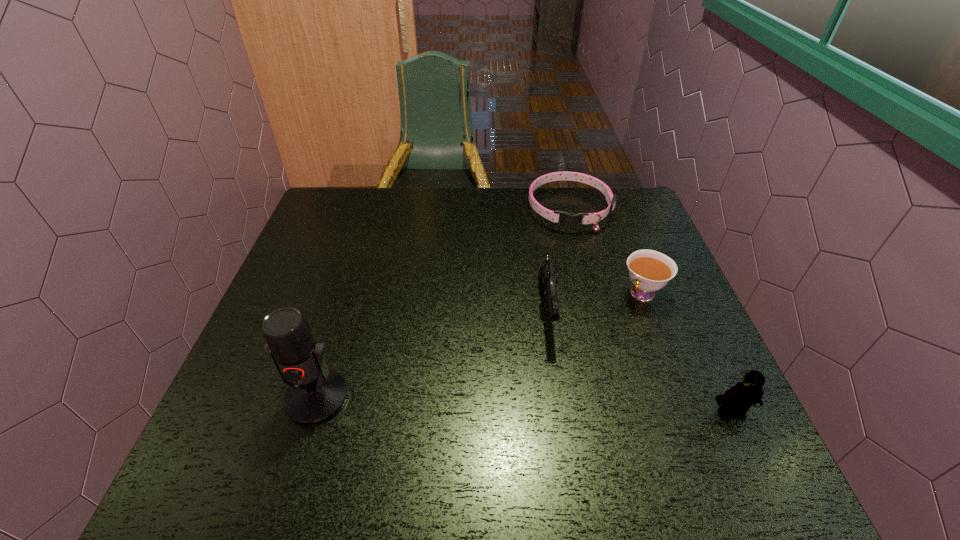
Identify the location of Lego present at the right edge. Image resolution: width=960 pixels, height=540 pixels. (735, 402).

Locate an element on the screen. This screenshot has height=540, width=960. teacup situated at the right edge is located at coordinates (649, 270).

Find the location of `dog collar at the right edge`. dog collar at the right edge is located at coordinates (568, 219).

Identify the location of object located at the near left corner. (316, 394).

The height and width of the screenshot is (540, 960). What are the coordinates of `object that is positioned at the far right corner` in the screenshot? It's located at (x=568, y=219).

This screenshot has height=540, width=960. I want to click on object located in the near right corner section of the desktop, so click(x=735, y=402).

You are a GUI agent. You are given a task and a screenshot of the screen. Output one action in this format:
    pyautogui.click(x=<x>, y=<y>)
    Task: Click on the vacant space at the far edge
    
    Given the screenshot: What is the action you would take?
    pyautogui.click(x=571, y=193)

Identify the location of free region at the near edge. Image resolution: width=960 pixels, height=540 pixels. (547, 433).

Find the location of `vacant space at the left edge of the desktop`. vacant space at the left edge of the desktop is located at coordinates (242, 368).

Locate an element on the screen. This screenshot has height=540, width=960. free space at the right edge is located at coordinates (645, 368).